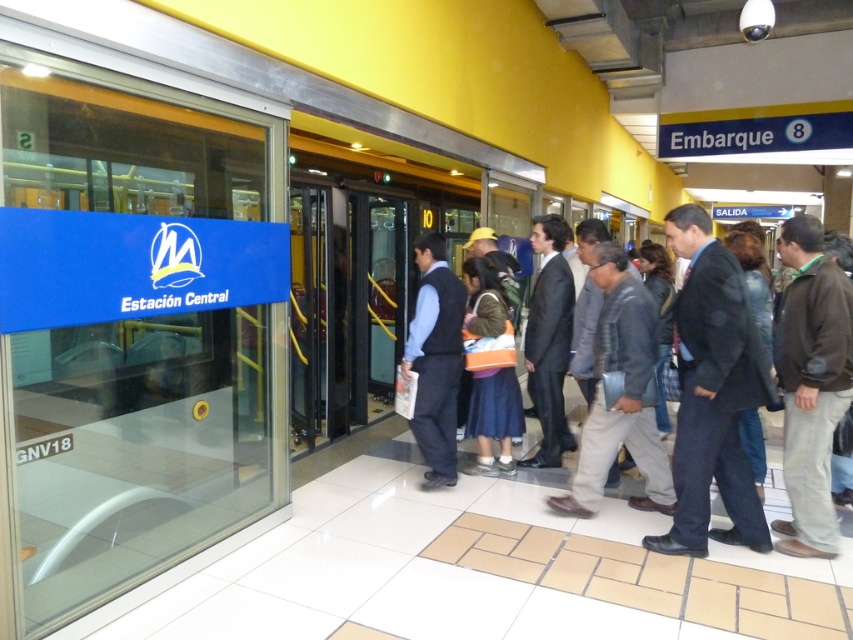
Who is positioned more to the right, dark blue suit at center or brown fabric jacket at right?

From the viewer's perspective, brown fabric jacket at right appears more on the right side.

Between dark blue suit at center and brown fabric jacket at right, which one has more height?

dark blue suit at center is taller.

Does point (677, 490) come farther from viewer compared to point (828, 445)?

Yes, point (677, 490) is farther from viewer.

Locate an element on the screen. This screenshot has width=853, height=640. dark blue suit at center is located at coordinates (712, 392).

Is dark gray suit at center shorter than dark blue suit at center?

Indeed, dark gray suit at center has a lesser height compared to dark blue suit at center.

Looking at this image, does dark gray suit at center appear under dark blue suit at center?

Indeed, dark gray suit at center is positioned under dark blue suit at center.

Identify the location of dark gray suit at center. (712, 394).

Who is shorter, gray woolen jacket at center or orange fabric backpack at center?

orange fabric backpack at center

Does gray woolen jacket at center appear on the left side of orange fabric backpack at center?

No, gray woolen jacket at center is not to the left of orange fabric backpack at center.

The image size is (853, 640). I want to click on gray woolen jacket at center, so click(x=619, y=394).